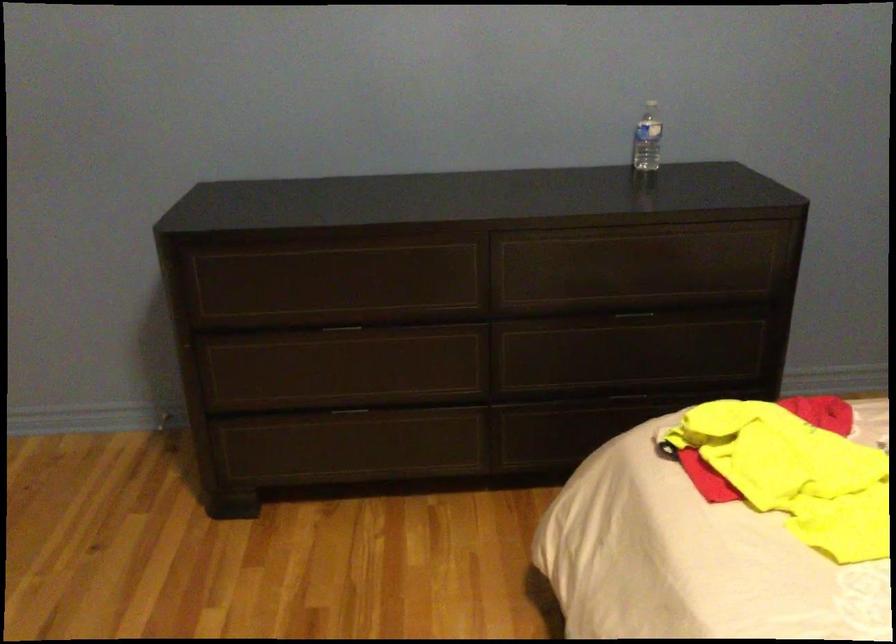
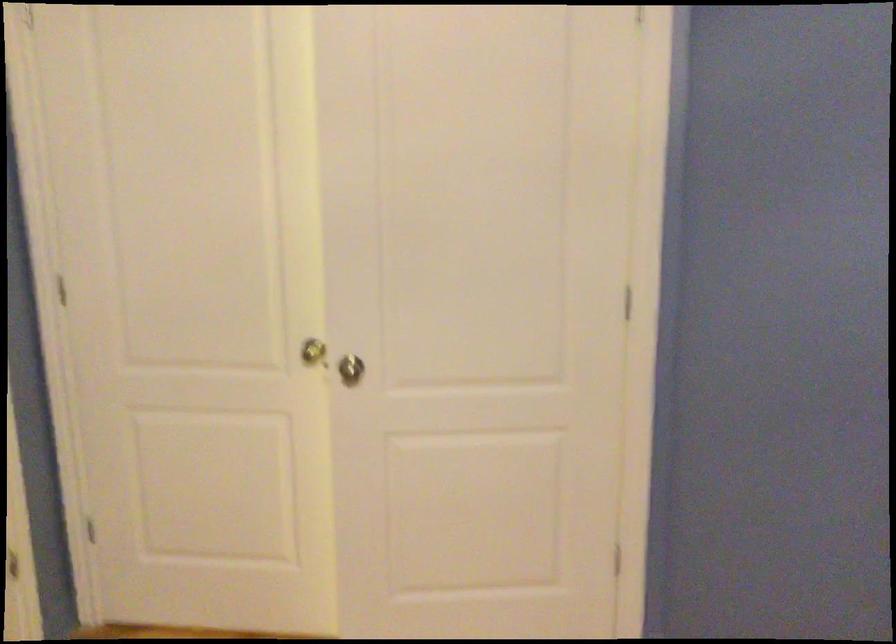
Question: The camera is either moving clockwise (left) or counter-clockwise (right) around the object. The first image is from the beginning of the video and the second image is from the end. Is the camera moving left or right when shooting the video?

Choices:
 (A) Left
 (B) Right

Answer: (B)